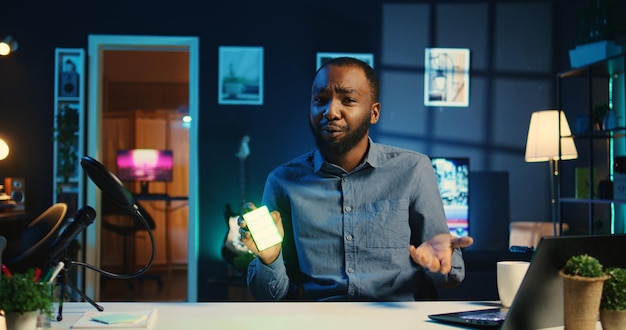
At what (x,y) coordinates should I click in order to perform the action: click on laptop. Please return your answer as a coordinate pair (x, y). Looking at the image, I should click on (525, 307).